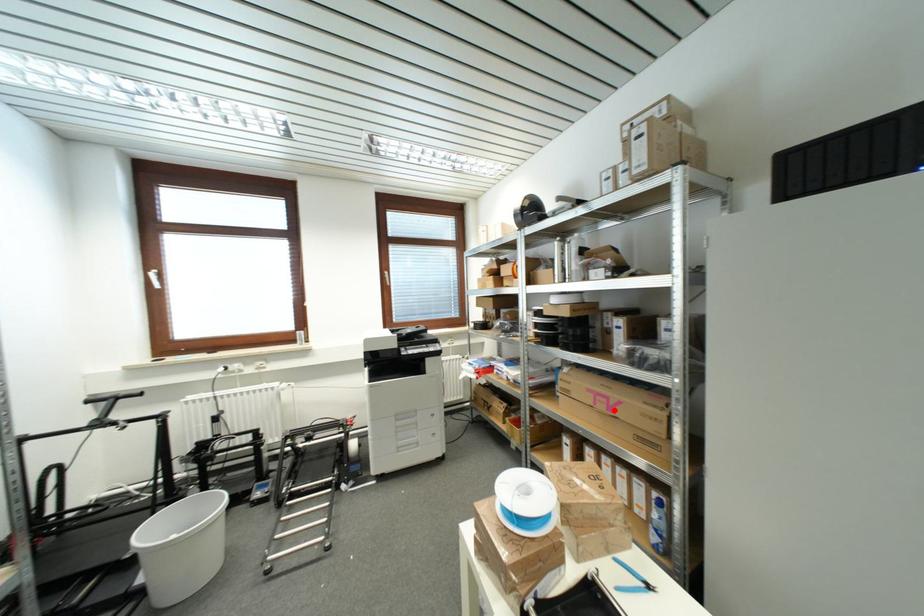
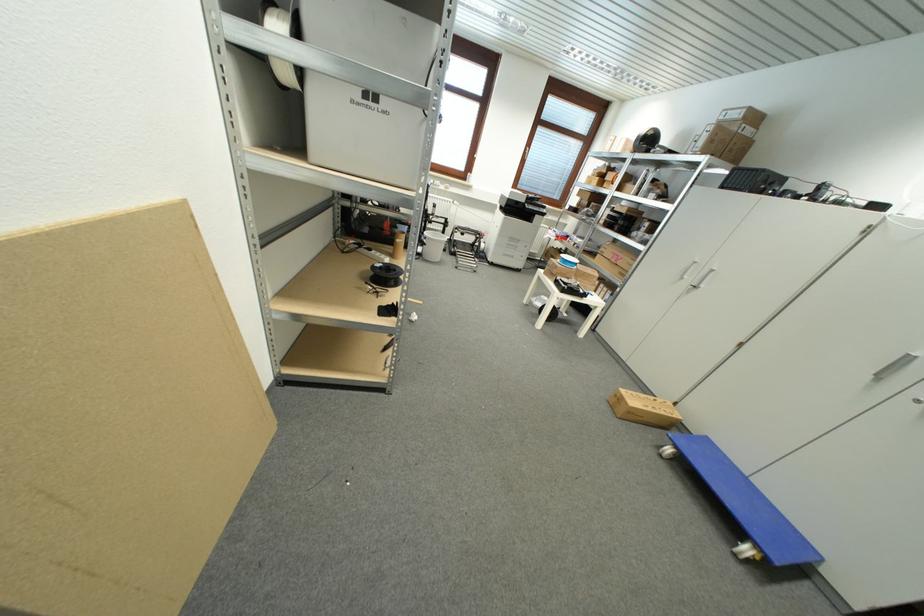
Where in the second image is the point corresponding to the highlighted location from the first image?

(621, 262)